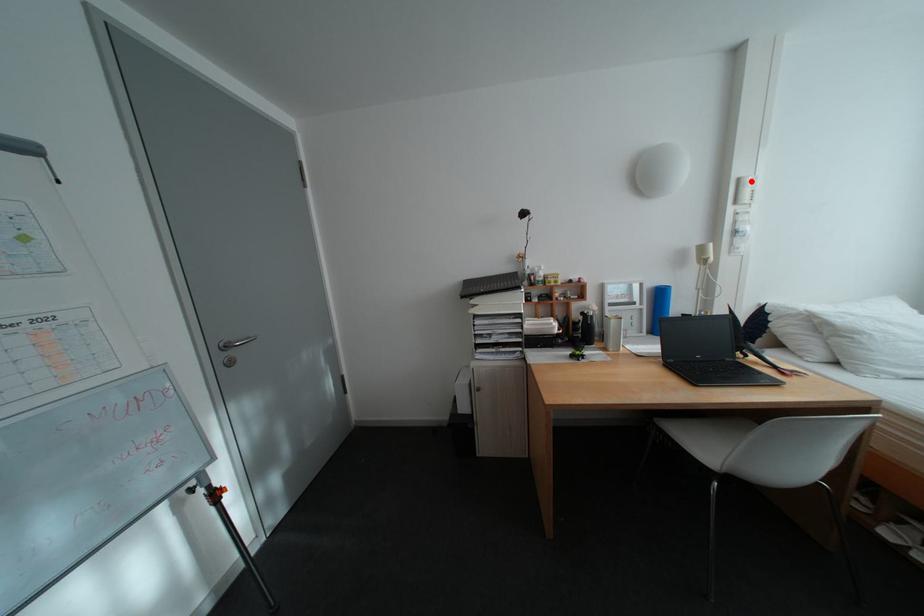
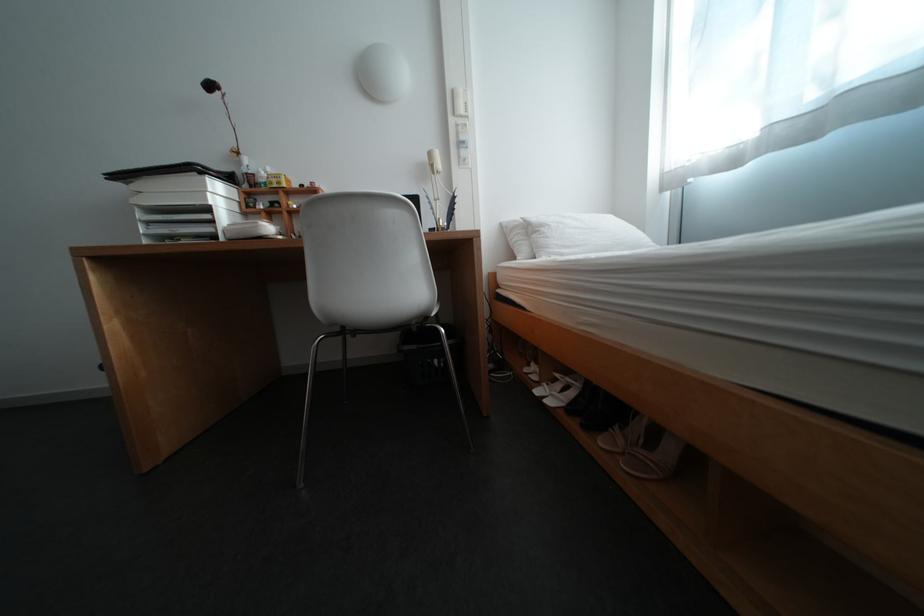
Question: I am providing you with two images of the same scene from different viewpoints. A red point is marked on the first image. Can you still see the location of the red point in image 2?

Choices:
 (A) Yes
 (B) No

Answer: (A)